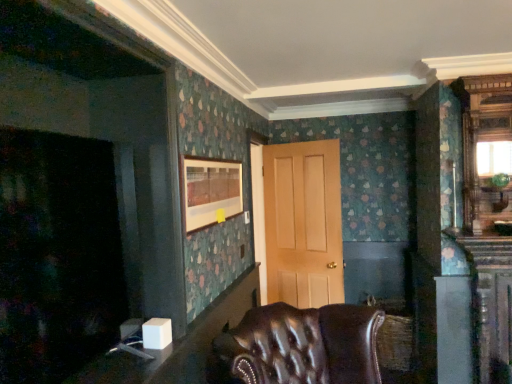
Question: In terms of size, does leather tufted chair at lower center appear bigger or smaller than light brown wood door at center?

Choices:
 (A) small
 (B) big

Answer: (B)

Question: In the image, is leather tufted chair at lower center on the left side or the right side of light brown wood door at center?

Choices:
 (A) right
 (B) left

Answer: (B)

Question: Which is farther from the white plastic table at lower left, marked as the 2th table in a top-to-bottom arrangement?

Choices:
 (A) matte wooden picture frame at upper center
 (B) light brown wood door at center
 (C) leather tufted chair at lower center
 (D) white glossy table at lower left, the 2th table in the bottom-to-top sequence

Answer: (B)

Question: Which is nearer to the white plastic table at lower left, the first table from the bottom?

Choices:
 (A) light brown wood door at center
 (B) white glossy table at lower left, placed as the 1th table when sorted from top to bottom
 (C) matte wooden picture frame at upper center
 (D) leather tufted chair at lower center

Answer: (B)